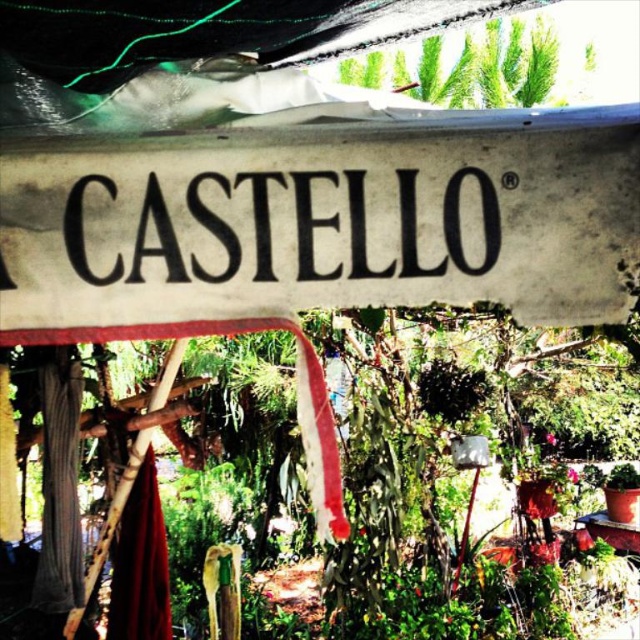
This screenshot has width=640, height=640. What do you see at coordinates (320, 221) in the screenshot?
I see `white paper sign at center` at bounding box center [320, 221].

Which is behind, point (634, 176) or point (496, 96)?

The point (496, 96) is more distant.

Where is `white paper sign at center`? Image resolution: width=640 pixels, height=640 pixels. white paper sign at center is located at coordinates (320, 221).

How distant is black paper sign at center from green leafy plant at upper center?

The distance of black paper sign at center from green leafy plant at upper center is 20.66 feet.

Does black paper sign at center have a greater height compared to green leafy plant at upper center?

No.

Where is `black paper sign at center`? Image resolution: width=640 pixels, height=640 pixels. black paper sign at center is located at coordinates (284, 227).

This screenshot has width=640, height=640. What are the coordinates of `black paper sign at center` in the screenshot? It's located at (284, 227).

Does point (524, 262) lie behind point (451, 257)?

That is False.

Describe the element at coordinates (320, 221) in the screenshot. I see `white paper sign at center` at that location.

Identify the location of white paper sign at center. (320, 221).